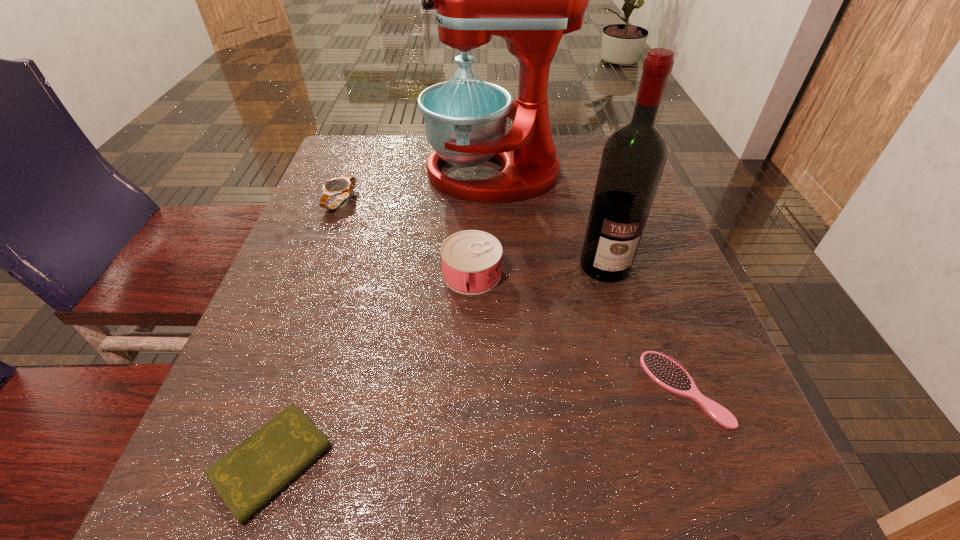
Image resolution: width=960 pixels, height=540 pixels. I want to click on vacant area situated on the left of the can, so click(x=326, y=274).

Image resolution: width=960 pixels, height=540 pixels. Identify the location of vacant space located on the front of the watch. (283, 352).

Find the location of a particular element. This screenshot has width=960, height=540. free region located on the back of the hairbrush is located at coordinates (622, 219).

This screenshot has height=540, width=960. What are the coordinates of `vacant position located 0.190m on the back of the shortest object` in the screenshot? It's located at (323, 309).

Where is `object located in the far edge section of the desktop`? The image size is (960, 540). object located in the far edge section of the desktop is located at coordinates pyautogui.click(x=531, y=0).

The height and width of the screenshot is (540, 960). In order to click on object at the near edge in this screenshot , I will do click(250, 475).

Locate an element on the screen. watch at the left edge is located at coordinates [343, 186].

Locate an element on the screen. The height and width of the screenshot is (540, 960). diary present at the left edge is located at coordinates (250, 475).

This screenshot has height=540, width=960. Find the location of `alcohol that is at the right edge`. alcohol that is at the right edge is located at coordinates (633, 158).

Locate an element on the screen. This screenshot has width=960, height=540. hairbrush that is at the right edge is located at coordinates (666, 372).